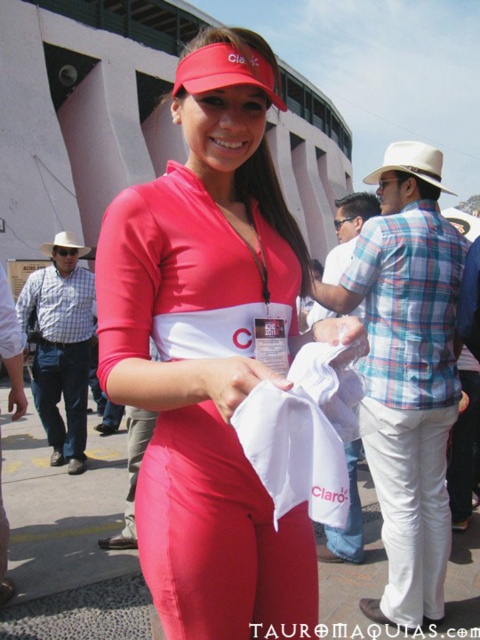
Does matte red uniform at center appear on the left side of beige straw hat at upper right?

Indeed, matte red uniform at center is positioned on the left side of beige straw hat at upper right.

From the picture: Can you confirm if matte red uniform at center is positioned above beige straw hat at upper right?

Actually, matte red uniform at center is below beige straw hat at upper right.

Between point (169, 588) and point (395, 170), which one is positioned in front?

Positioned in front is point (169, 588).

Where is `matte red uniform at center`? matte red uniform at center is located at coordinates [211, 349].

Can you confirm if beige straw hat at upper right is positioned above white felt baseball hat at left?

Correct, beige straw hat at upper right is located above white felt baseball hat at left.

Is beige straw hat at upper right further to the viewer compared to white felt baseball hat at left?

That is False.

At what (x,y) coordinates should I click in order to perform the action: click on beige straw hat at upper right. Please return your answer as a coordinate pair (x, y). The image size is (480, 640). Looking at the image, I should click on (411, 163).

Identify the location of beige straw hat at upper right. The image size is (480, 640). (411, 163).

Does matte red uniform at center have a greater width compared to white felt baseball hat at left?

Incorrect, matte red uniform at center's width does not surpass white felt baseball hat at left's.

Can you confirm if matte red uniform at center is thinner than white felt baseball hat at left?

Yes.

At what (x,y) coordinates should I click in order to perform the action: click on matte red uniform at center. Please return your answer as a coordinate pair (x, y). This screenshot has height=640, width=480. Looking at the image, I should click on (211, 349).